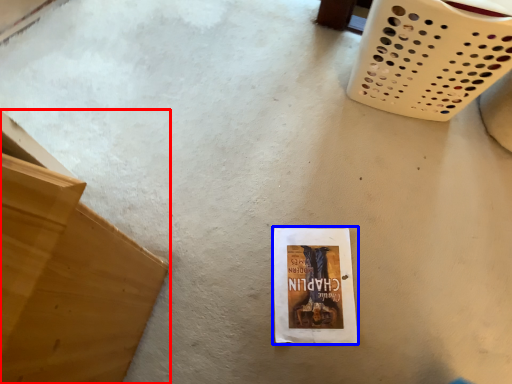
Question: Which object appears closest to the camera in this image, furniture (highlighted by a red box) or paperback book (highlighted by a blue box)?

Choices:
 (A) furniture
 (B) paperback book

Answer: (A)